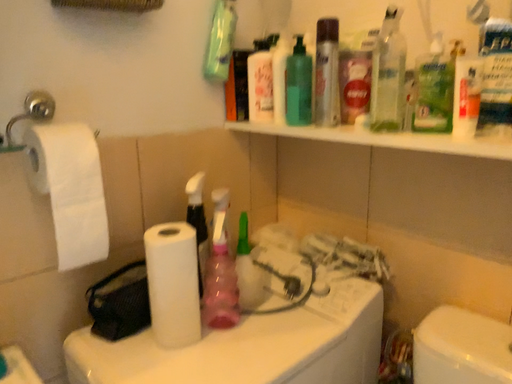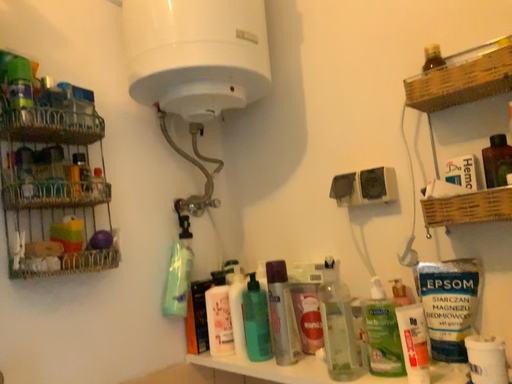
Question: Which way did the camera rotate in the video?

Choices:
 (A) rotated upward
 (B) rotated downward

Answer: (A)